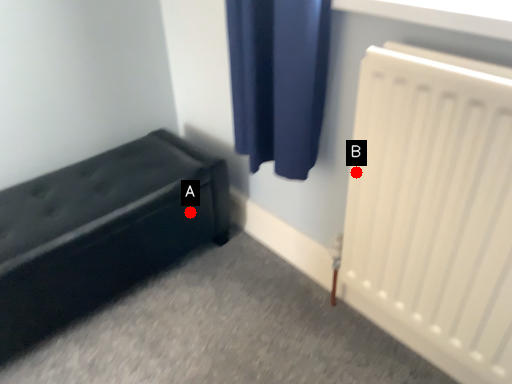
Question: Two points are circled on the image, labeled by A and B beside each circle. Which of the following is the farthest from the observer?

Choices:
 (A) A is further
 (B) B is further

Answer: (A)